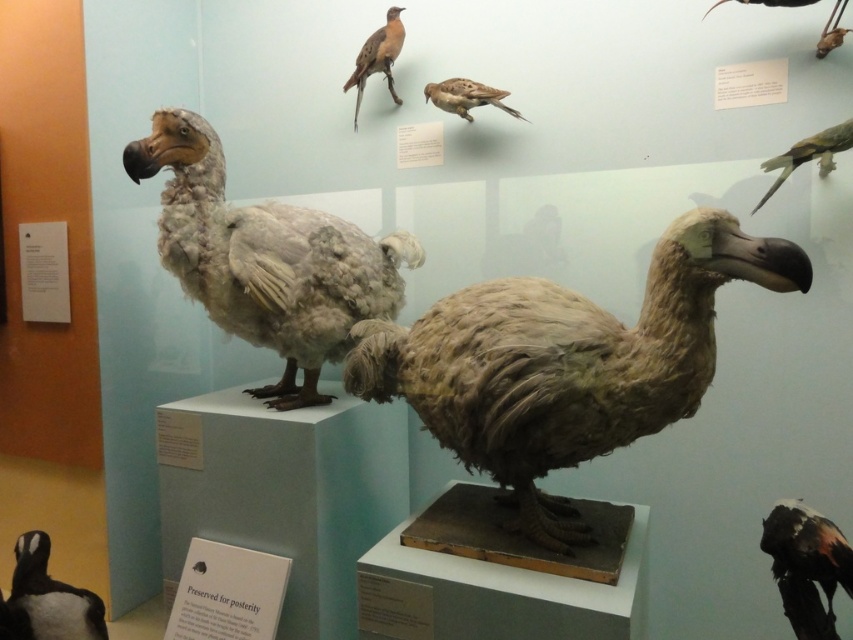
Does brown fuzzy dodo at center come behind brown matte bird at upper center?

No, brown fuzzy dodo at center is closer to the viewer.

Who is shorter, brown fuzzy dodo at center or brown matte bird at upper center?

With less height is brown matte bird at upper center.

Is point (468, 285) closer to camera compared to point (395, 48)?

That is True.

Find the location of a particular element. brown fuzzy dodo at center is located at coordinates (566, 364).

Is gray fluffy dodo at center wider than black matte penguin at lower left?

Yes.

Which is above, gray fluffy dodo at center or black matte penguin at lower left?

gray fluffy dodo at center

This screenshot has height=640, width=853. What are the coordinates of `gray fluffy dodo at center` in the screenshot? It's located at (265, 259).

Image resolution: width=853 pixels, height=640 pixels. I want to click on gray fluffy dodo at center, so click(265, 259).

Who is positioned more to the right, black glossy bird at lower right or black matte penguin at lower left?

black glossy bird at lower right

Is black glossy bird at lower right to the left of black matte penguin at lower left from the viewer's perspective?

In fact, black glossy bird at lower right is to the right of black matte penguin at lower left.

Find the location of a particular element. The image size is (853, 640). black glossy bird at lower right is located at coordinates (805, 564).

Find the location of a particular element. black glossy bird at lower right is located at coordinates (805, 564).